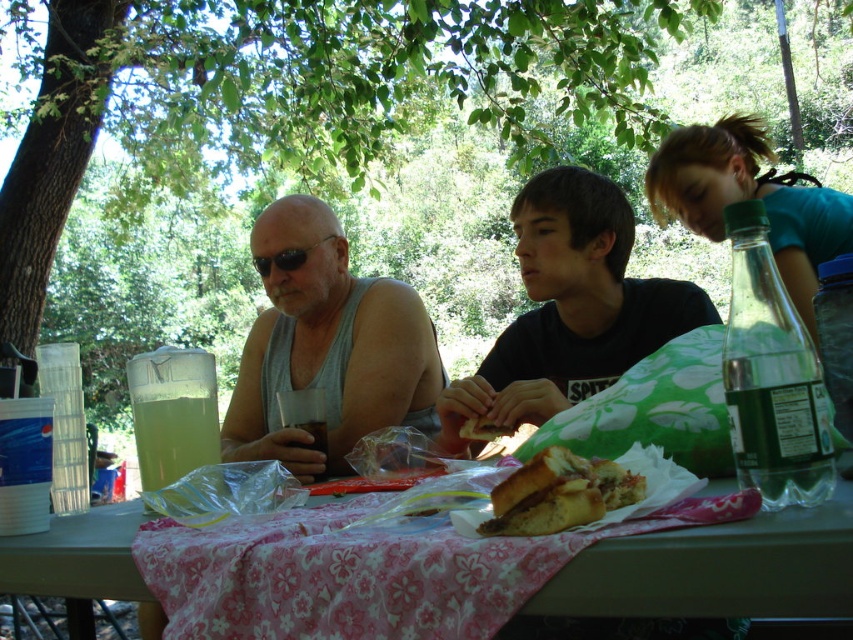
Question: Does brown bread sandwich at center have a smaller size compared to black plastic sunglasses at left?

Choices:
 (A) no
 (B) yes

Answer: (B)

Question: From the image, what is the correct spatial relationship of brown bread at center in relation to translucent plastic cup at center?

Choices:
 (A) below
 (B) above

Answer: (B)

Question: Which object is the closest to the pink floral tablecloth at lower center?

Choices:
 (A) brown bread sandwich at center
 (B) translucent plastic cup at table left
 (C) black matte shirt at center
 (D) teal fabric shirt at upper right

Answer: (A)

Question: Which point appears farthest from the camera in this image?

Choices:
 (A) (309, 371)
 (B) (465, 426)

Answer: (A)

Question: Is pink floral tablecloth at lower center thinner than translucent plastic cup at table left?

Choices:
 (A) no
 (B) yes

Answer: (A)

Question: Which of the following is the closest to the observer?

Choices:
 (A) pink floral tablecloth at lower center
 (B) translucent plastic cup at table left
 (C) brown bread sandwich at center

Answer: (A)